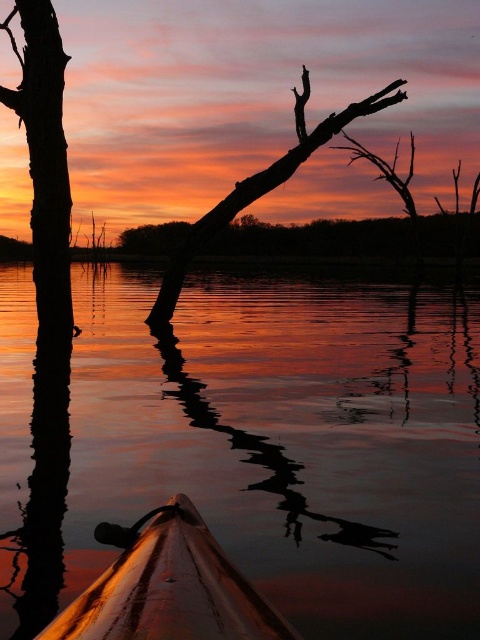
Question: Does glossy water at center appear over silhouette wood at left?

Choices:
 (A) yes
 (B) no

Answer: (B)

Question: Considering the real-world distances, which object is farthest from the silhouette wood at left?

Choices:
 (A) silhouette wood at center
 (B) glossy water at center

Answer: (B)

Question: Which point appears closest to the camera in this image?

Choices:
 (A) (56, 188)
 (B) (333, 116)
 (C) (154, 621)
 (D) (453, 412)

Answer: (C)

Question: Where is wooden kayak at center located in relation to silhouette wood at left in the image?

Choices:
 (A) left
 (B) right

Answer: (B)

Question: Does silhouette wood at left appear on the left side of silhouette wood at center?

Choices:
 (A) yes
 (B) no

Answer: (A)

Question: Considering the real-world distances, which object is farthest from the silhouette wood at left?

Choices:
 (A) glossy water at center
 (B) wooden kayak at center

Answer: (B)